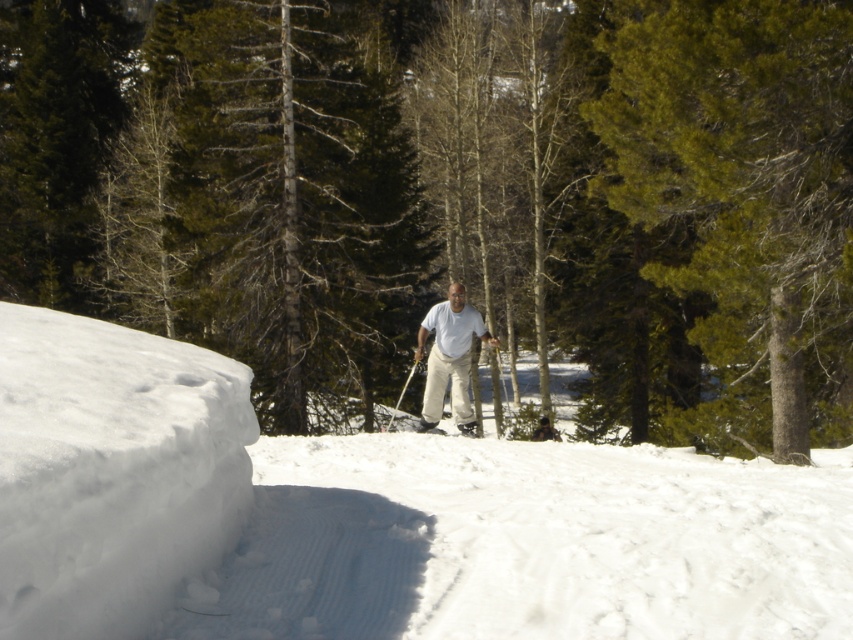
You are navigating through the snowy slope and want to reach the point marked at coordinates point (747, 44). There is another point at point (395, 412) in your path. Which point should you avoid to stay on the correct path?

Since point (747, 44) is in front of point (395, 412), you should avoid going around point (395, 412) to stay on the correct path towards point (747, 44).